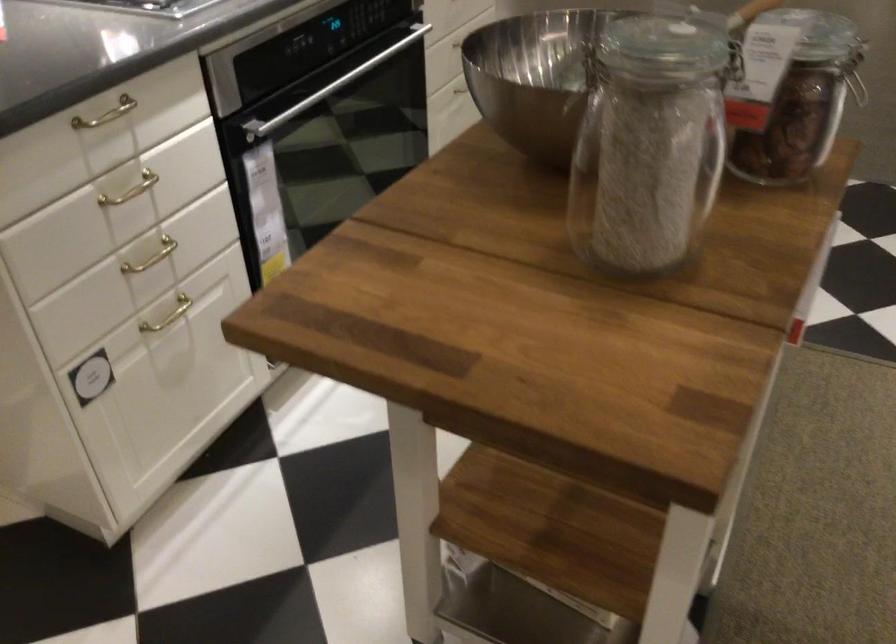
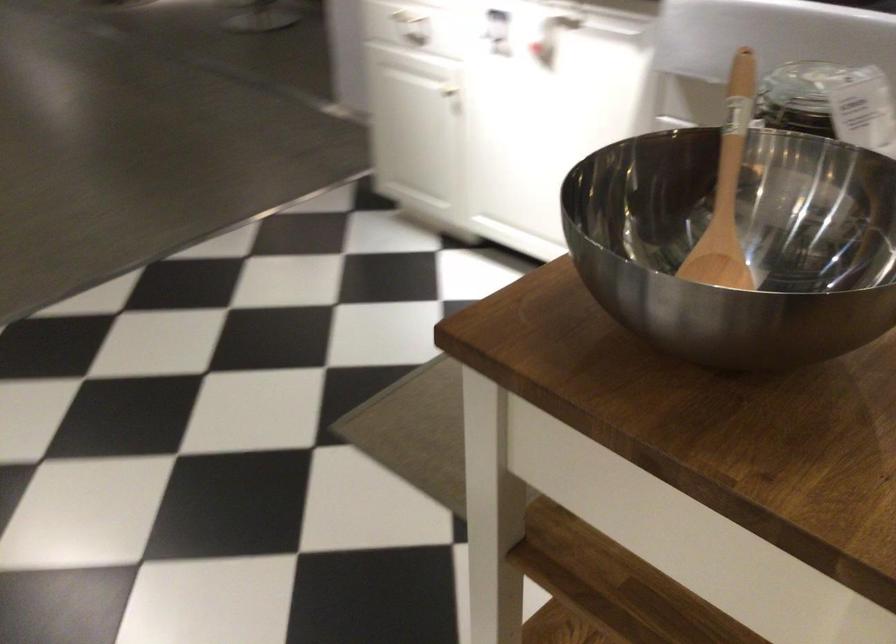
Question: The camera is either moving clockwise (left) or counter-clockwise (right) around the object. The first image is from the beginning of the video and the second image is from the end. Is the camera moving left or right when shooting the video?

Choices:
 (A) Left
 (B) Right

Answer: (A)